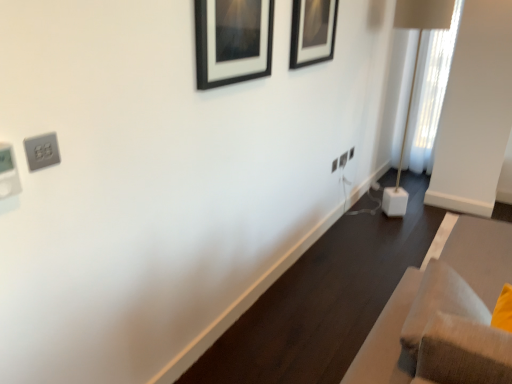
Question: Can you confirm if satin silver outlet at upper left, the third electric outlet in the back-to-front sequence, is bigger than black matte picture frame at upper center, placed as the first picture frame when sorted from right to left?

Choices:
 (A) yes
 (B) no

Answer: (B)

Question: From a real-world perspective, is satin silver outlet at upper left, placed as the 1th electric outlet when sorted from left to right, over black matte picture frame at upper center, the second picture frame in the left-to-right sequence?

Choices:
 (A) yes
 (B) no

Answer: (B)

Question: Considering the relative sizes of satin silver outlet at upper left, placed as the 1th electric outlet when sorted from left to right, and black matte picture frame at upper center, placed as the first picture frame when sorted from right to left, in the image provided, is satin silver outlet at upper left, placed as the 1th electric outlet when sorted from left to right, thinner than black matte picture frame at upper center, placed as the first picture frame when sorted from right to left,?

Choices:
 (A) yes
 (B) no

Answer: (A)

Question: Is satin silver outlet at upper left, the third electric outlet in the back-to-front sequence, facing towards black matte picture frame at upper center, the second picture frame in the left-to-right sequence?

Choices:
 (A) yes
 (B) no

Answer: (B)

Question: Is satin silver outlet at upper left, the 3th electric outlet positioned from the right, facing away from black matte picture frame at upper center, which is the first picture frame in back-to-front order?

Choices:
 (A) no
 (B) yes

Answer: (A)

Question: Based on their positions, is black matte picture frame at upper center, which is counted as the second picture frame, starting from the right, located to the left or right of white plastic electric outlet at center-right, the first electric outlet when ordered from top to bottom?

Choices:
 (A) left
 (B) right

Answer: (A)

Question: Considering the positions of black matte picture frame at upper center, marked as the 1th picture frame in a left-to-right arrangement, and white plastic electric outlet at center-right, the first electric outlet positioned from the back, in the image, is black matte picture frame at upper center, marked as the 1th picture frame in a left-to-right arrangement, taller or shorter than white plastic electric outlet at center-right, the first electric outlet positioned from the back,?

Choices:
 (A) tall
 (B) short

Answer: (A)

Question: In terms of width, does black matte picture frame at upper center, positioned as the first picture frame in front-to-back order, look wider or thinner when compared to white plastic electric outlet at center-right, positioned as the 3th electric outlet in left-to-right order?

Choices:
 (A) wide
 (B) thin

Answer: (A)

Question: Do you think black matte picture frame at upper center, positioned as the first picture frame in front-to-back order, is within white plastic electric outlet at center-right, the first electric outlet positioned from the back, or outside of it?

Choices:
 (A) inside
 (B) outside

Answer: (B)

Question: Considering their positions, is black matte picture frame at upper center, acting as the second picture frame starting from the front, located in front of or behind white plastic electric outlet at center-right, which is the second electric outlet from back to front?

Choices:
 (A) front
 (B) behind

Answer: (A)

Question: In the image, is black matte picture frame at upper center, which is the first picture frame in back-to-front order, on the left side or the right side of white plastic electric outlet at center-right, placed as the second electric outlet when sorted from left to right?

Choices:
 (A) right
 (B) left

Answer: (B)

Question: Do you think black matte picture frame at upper center, the second picture frame in the left-to-right sequence, is within white plastic electric outlet at center-right, which is the second electric outlet from bottom to top, or outside of it?

Choices:
 (A) outside
 (B) inside

Answer: (A)

Question: Is point (307, 56) closer or farther from the camera than point (343, 158)?

Choices:
 (A) closer
 (B) farther

Answer: (A)

Question: From a real-world perspective, is white cube base at right positioned above or below white plastic electric outlet at center-right, the first electric outlet positioned from the back?

Choices:
 (A) below
 (B) above

Answer: (B)

Question: Considering the positions of point pyautogui.click(x=399, y=8) and point pyautogui.click(x=353, y=147), is point pyautogui.click(x=399, y=8) closer or farther from the camera than point pyautogui.click(x=353, y=147)?

Choices:
 (A) closer
 (B) farther

Answer: (A)